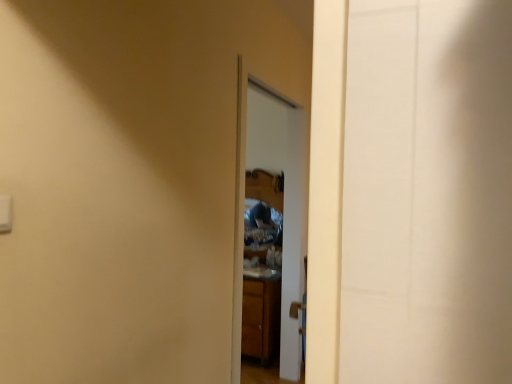
Question: Is wooden cabinet at center aimed at glossy wooden mirror at center?

Choices:
 (A) yes
 (B) no

Answer: (B)

Question: Is glossy wooden mirror at center completely or partially inside wooden cabinet at center?

Choices:
 (A) no
 (B) yes

Answer: (A)

Question: Considering the relative sizes of wooden cabinet at center and glossy wooden mirror at center in the image provided, is wooden cabinet at center shorter than glossy wooden mirror at center?

Choices:
 (A) no
 (B) yes

Answer: (A)

Question: Is wooden cabinet at center oriented away from glossy wooden mirror at center?

Choices:
 (A) no
 (B) yes

Answer: (A)

Question: From the image's perspective, is wooden cabinet at center under glossy wooden mirror at center?

Choices:
 (A) no
 (B) yes

Answer: (B)

Question: Is the position of wooden cabinet at center more distant than that of glossy wooden mirror at center?

Choices:
 (A) yes
 (B) no

Answer: (A)

Question: Does white plastic light switch at upper left appear on the right side of glossy wooden mirror at center?

Choices:
 (A) yes
 (B) no

Answer: (B)

Question: Is white plastic light switch at upper left not near glossy wooden mirror at center?

Choices:
 (A) no
 (B) yes

Answer: (B)

Question: From a real-world perspective, is white plastic light switch at upper left located beneath glossy wooden mirror at center?

Choices:
 (A) yes
 (B) no

Answer: (B)

Question: Is white plastic light switch at upper left at the left side of glossy wooden mirror at center?

Choices:
 (A) yes
 (B) no

Answer: (A)

Question: Does white plastic light switch at upper left have a greater width compared to glossy wooden mirror at center?

Choices:
 (A) yes
 (B) no

Answer: (B)

Question: Is white plastic light switch at upper left turned away from glossy wooden mirror at center?

Choices:
 (A) no
 (B) yes

Answer: (A)

Question: Is wooden cabinet at center completely or partially inside white plastic light switch at upper left?

Choices:
 (A) no
 (B) yes

Answer: (A)